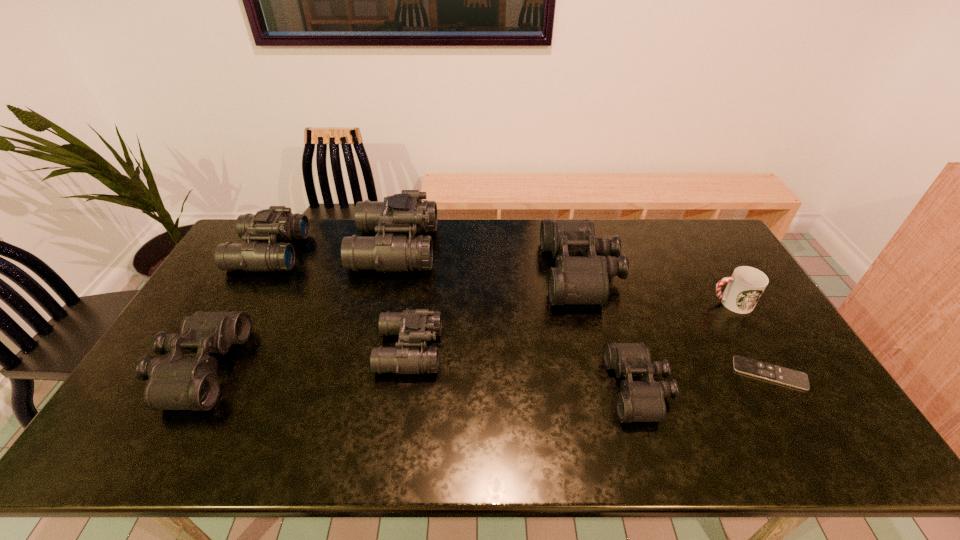
At what (x,y) coordinates should I click in order to perform the action: click on the tallest binoculars. Please return your answer as a coordinate pair (x, y). The image size is (960, 540). Looking at the image, I should click on (400, 213).

The width and height of the screenshot is (960, 540). Identify the location of the biggest blue binoculars. (400, 213).

Find the location of a particular element. Image resolution: width=960 pixels, height=540 pixels. the leftmost blue binoculars is located at coordinates (276, 223).

Locate an element on the screen. The height and width of the screenshot is (540, 960). the farthest black binoculars is located at coordinates (582, 267).

This screenshot has height=540, width=960. In order to click on the smallest blue binoculars in this screenshot , I will do `click(410, 356)`.

This screenshot has height=540, width=960. Identify the location of the leftmost black binoculars. (174, 383).

At what (x,y) coordinates should I click in order to perform the action: click on red cup. Please return your answer as a coordinate pair (x, y). Looking at the image, I should click on (746, 285).

Identify the location of the seventh tallest object. (639, 401).

The image size is (960, 540). Find the location of `the shortest binoculars`. the shortest binoculars is located at coordinates (639, 401).

Find the location of `the shortest object`. the shortest object is located at coordinates (755, 368).